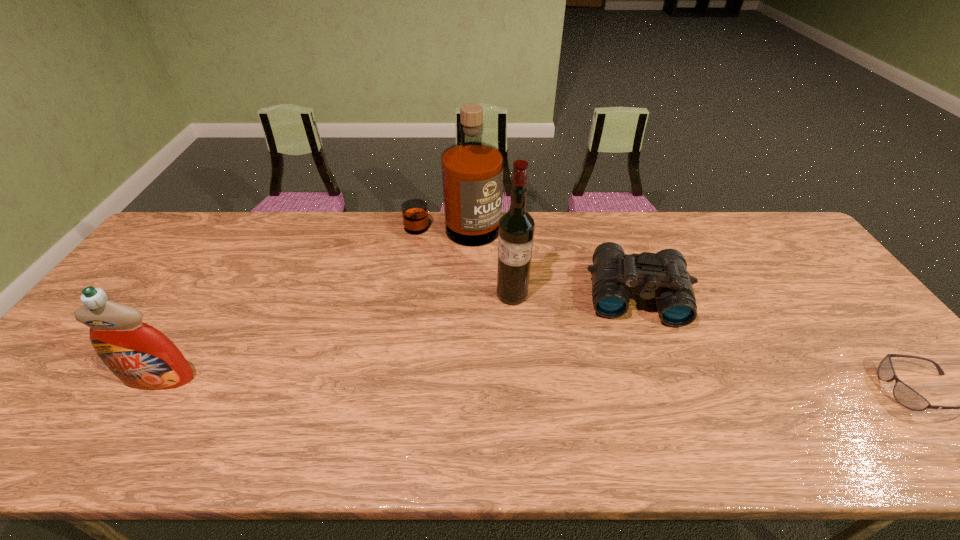
The image size is (960, 540). In the image, there is a desktop. What are the coordinates of `free space at the far left corner` in the screenshot? It's located at (179, 228).

The width and height of the screenshot is (960, 540). In the image, there is a desktop. Identify the location of free space at the near left corner. (84, 409).

Identify the location of vacant point located between the third tallest object and the farthest object. (306, 304).

Identify the location of vacant space in between the second shortest object and the liquor. This screenshot has height=540, width=960. (544, 262).

Locate an element on the screen. The height and width of the screenshot is (540, 960). blank region between the farthest object and the second object from right to left is located at coordinates [544, 262].

The image size is (960, 540). I want to click on free space between the wine bottle and the third tallest object, so click(x=336, y=337).

Identify which object is the fourth nearest to the liquor. Please provide its 2D coordinates. Your answer should be formatted as a tuple, i.e. [(x, y)], where the tuple contains the x and y coordinates of a point satisfying the conditions above.

[(906, 396)]

Identify which object is located as the second nearest to the leftmost object. Please provide its 2D coordinates. Your answer should be formatted as a tuple, i.e. [(x, y)], where the tuple contains the x and y coordinates of a point satisfying the conditions above.

[(516, 227)]

Locate an element on the screen. This screenshot has height=540, width=960. vacant space that satisfies the following two spatial constraints: 1. on the back side of the wine bottle; 2. on the left side of the fourth tallest object is located at coordinates (512, 295).